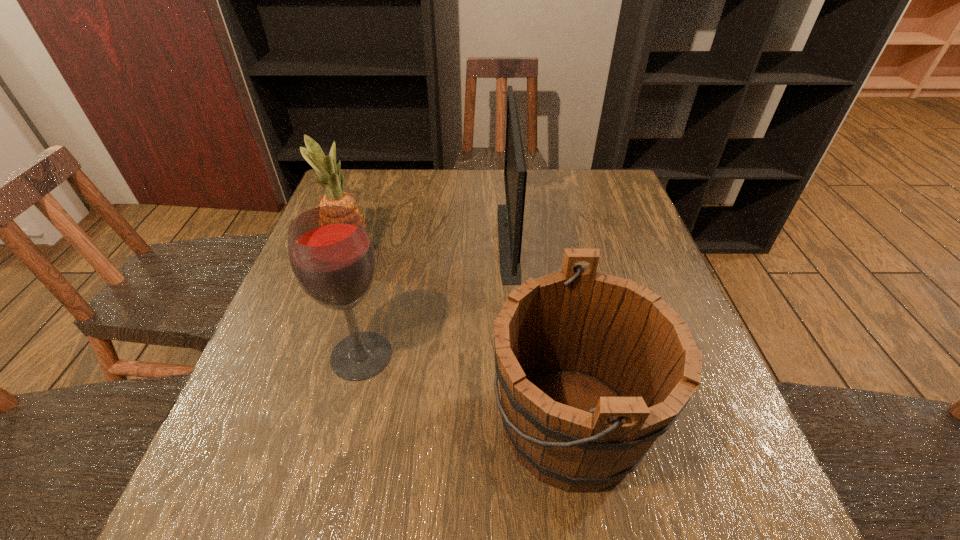
Identify which object is located as the second nearest to the wine bucket. Please provide its 2D coordinates. Your answer should be formatted as a tuple, i.e. [(x, y)], where the tuple contains the x and y coordinates of a point satisfying the conditions above.

[(332, 257)]

Identify which object is located as the second nearest to the pineapple. Please provide its 2D coordinates. Your answer should be formatted as a tuple, i.e. [(x, y)], where the tuple contains the x and y coordinates of a point satisfying the conditions above.

[(510, 217)]

Locate an element on the screen. This screenshot has height=540, width=960. vacant region that satisfies the following two spatial constraints: 1. on the front-facing side of the monitor; 2. on the front side of the pineapple is located at coordinates coord(509,251).